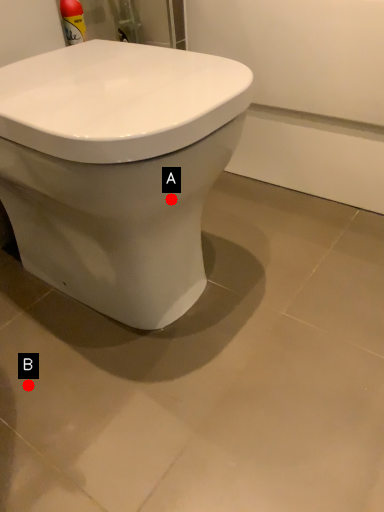
Question: Two points are circled on the image, labeled by A and B beside each circle. Which point is closer to the camera?

Choices:
 (A) A is closer
 (B) B is closer

Answer: (A)